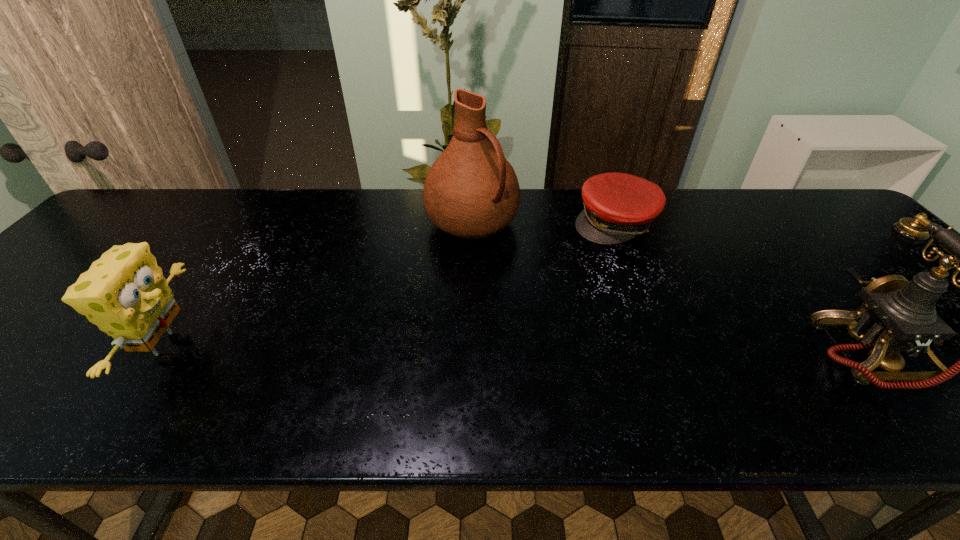
The image size is (960, 540). Identify the location of the leftmost object. (124, 293).

Locate an element on the screen. sponge is located at coordinates (124, 293).

Where is `pitcher`? The image size is (960, 540). pitcher is located at coordinates (471, 191).

Where is `the second object from left to right`? Image resolution: width=960 pixels, height=540 pixels. the second object from left to right is located at coordinates (471, 191).

Where is `cap`? The image size is (960, 540). cap is located at coordinates (617, 207).

The height and width of the screenshot is (540, 960). Identify the location of the second object from right to left. 617,207.

Find the location of a particular element. The image size is (960, 540). free region located 0.220m on the face of the leftmost object is located at coordinates [x=301, y=349].

What are the coordinates of `free space located 0.210m on the side of the third object from right to left with the handle` in the screenshot? It's located at (545, 293).

This screenshot has height=540, width=960. I want to click on free location located on the side of the third object from right to left with the handle, so click(521, 269).

What are the coordinates of `vacant space positioned on the side of the third object from right to left with the handle` in the screenshot? It's located at (588, 334).